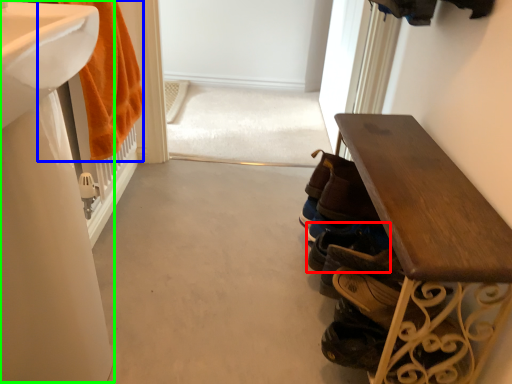
Question: Estimate the real-world distances between objects in this image. Which object is closer to footwear (highlighted by a red box), bath towel (highlighted by a blue box) or sink (highlighted by a green box)?

Choices:
 (A) bath towel
 (B) sink

Answer: (B)